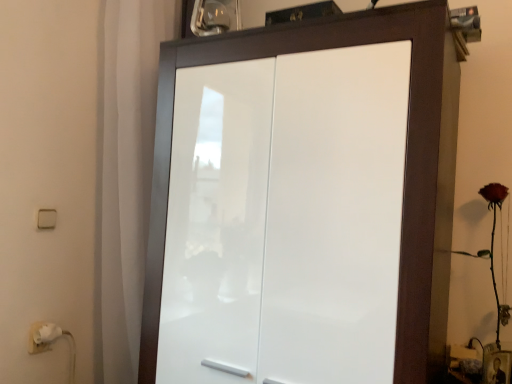
Describe the element at coordinates (304, 202) in the screenshot. Image resolution: width=512 pixels, height=384 pixels. I see `white glossy cupboard at center` at that location.

What do you see at coordinates (47, 218) in the screenshot? The height and width of the screenshot is (384, 512). I see `white plastic light switch at left` at bounding box center [47, 218].

Locate an element on the screen. white matte curtain at left is located at coordinates (128, 169).

Find the location of a particular element. The height and width of the screenshot is (384, 512). matte red rose at right is located at coordinates (493, 248).

Which object is thinner, white plastic light switch at left or white matte curtain at left?

Thinner between the two is white plastic light switch at left.

Is white plastic light switch at left positioned with its back to white matte curtain at left?

white plastic light switch at left is not turned away from white matte curtain at left.

Between white plastic light switch at left and white matte curtain at left, which one has more height?

Standing taller between the two is white matte curtain at left.

Considering the sizes of objects matte red rose at right and white glossy cupboard at center in the image provided, who is bigger, matte red rose at right or white glossy cupboard at center?

white glossy cupboard at center is bigger.

Which object is further away from the camera taking this photo, matte red rose at right or white glossy cupboard at center?

Positioned behind is matte red rose at right.

Is matte red rose at right not within white glossy cupboard at center?

Absolutely, matte red rose at right is external to white glossy cupboard at center.

Does point (55, 213) appear closer or farther from the camera than point (255, 71)?

Point (55, 213).

Does white plastic light switch at left lie behind white glossy cupboard at center?

Yes, white plastic light switch at left is behind white glossy cupboard at center.

Who is bigger, white plastic light switch at left or white glossy cupboard at center?

white glossy cupboard at center is bigger.

From a real-world perspective, is white plastic light switch at left physically located above or below white glossy cupboard at center?

In terms of real-world spatial position, white plastic light switch at left is above white glossy cupboard at center.

Does matte red rose at right turn towards white plastic light switch at left?

No, matte red rose at right is not oriented towards white plastic light switch at left.

Locate an element on the screen. This screenshot has height=384, width=512. light switch that is above the matte red rose at right (from the image's perspective) is located at coordinates (47, 218).

Does point (482, 196) lie behind point (50, 219)?

No, (482, 196) is closer to viewer.

Is matte red rose at right in front of or behind white plastic light switch at left in the image?

matte red rose at right is positioned closer to the viewer than white plastic light switch at left.

Can you confirm if white glossy cupboard at center is bigger than matte red rose at right?

Correct, white glossy cupboard at center is larger in size than matte red rose at right.

Based on the photo, would you say white glossy cupboard at center is inside or outside matte red rose at right?

white glossy cupboard at center cannot be found inside matte red rose at right.

From the image's perspective, would you say white glossy cupboard at center is positioned over matte red rose at right?

Yes.

Is white plastic light switch at left positioned far away from matte red rose at right?

Yes, white plastic light switch at left and matte red rose at right are located far from each other.

Does white plastic light switch at left have a larger size compared to matte red rose at right?

No.

Is matte red rose at right surrounded by white plastic light switch at left?

No.

Is matte red rose at right wider than white matte curtain at left?

No.

Does matte red rose at right have a greater height compared to white matte curtain at left?

No.

From the image's perspective, is matte red rose at right above or below white matte curtain at left?

Clearly, from the image's perspective, matte red rose at right is below white matte curtain at left.

Is white matte curtain at left located within matte red rose at right?

No, white matte curtain at left is not a part of matte red rose at right.

Locate an element on the screen. curtain behind the white plastic light switch at left is located at coordinates (128, 169).

This screenshot has height=384, width=512. I want to click on flower on the right of white glossy cupboard at center, so click(493, 248).

Which object lies nearer to the anchor point matte red rose at right, white plastic light switch at left or white glossy cupboard at center?

white glossy cupboard at center is positioned closer to the anchor matte red rose at right.

Based on their spatial positions, is white plastic light switch at left or matte red rose at right closer to white glossy cupboard at center?

matte red rose at right is closer to white glossy cupboard at center.

Which object lies nearer to the anchor point white glossy cupboard at center, matte red rose at right or white plastic light switch at left?

matte red rose at right is closer to white glossy cupboard at center.

Estimate the real-world distances between objects in this image. Which object is closer to white matte curtain at left, matte red rose at right or white plastic light switch at left?

white plastic light switch at left is positioned closer to the anchor white matte curtain at left.

Estimate the real-world distances between objects in this image. Which object is further from white glossy cupboard at center, white matte curtain at left or white plastic light switch at left?

white plastic light switch at left.

Looking at the image, which one is located further to white plastic light switch at left, white matte curtain at left or matte red rose at right?

matte red rose at right is further to white plastic light switch at left.

From the image, which object appears to be nearer to matte red rose at right, white glossy cupboard at center or white plastic light switch at left?

white glossy cupboard at center is positioned closer to the anchor matte red rose at right.

From the image, which object appears to be farther from matte red rose at right, white matte curtain at left or white glossy cupboard at center?

The object further to matte red rose at right is white matte curtain at left.

The height and width of the screenshot is (384, 512). I want to click on curtain located between white plastic light switch at left and matte red rose at right in the left-right direction, so pos(128,169).

Locate an element on the screen. The width and height of the screenshot is (512, 384). cupboard located between white plastic light switch at left and matte red rose at right in the left-right direction is located at coordinates (304, 202).

I want to click on curtain located between white plastic light switch at left and white glossy cupboard at center in the left-right direction, so click(128, 169).

Locate an element on the screen. This screenshot has width=512, height=384. cupboard between white matte curtain at left and matte red rose at right in the horizontal direction is located at coordinates 304,202.